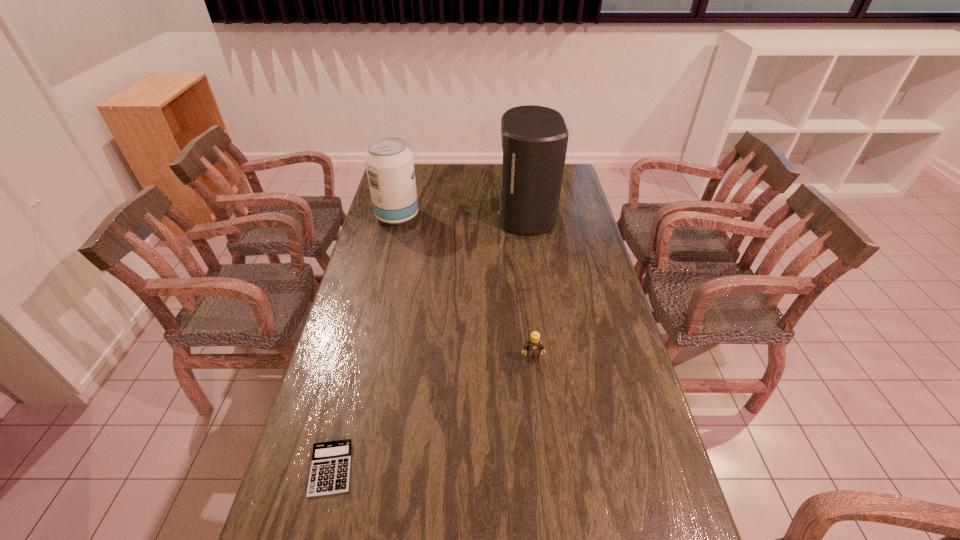
The image size is (960, 540). What are the coordinates of `unoccupied area between the coffee maker and the calculator` in the screenshot? It's located at (428, 341).

Find the location of a particular element. Image resolution: width=960 pixels, height=540 pixels. free space between the alcohol and the tallest object is located at coordinates 462,215.

Find the location of `empty space that is in between the tallest object and the third shortest object`. empty space that is in between the tallest object and the third shortest object is located at coordinates (462, 215).

This screenshot has width=960, height=540. In order to click on empty space between the nearest object and the alcohol in this screenshot , I will do `click(364, 342)`.

You are a GUI agent. You are given a task and a screenshot of the screen. Output one action in this format:
    pyautogui.click(x=<x>, y=<y>)
    Task: Click on the vacant space in between the alcohol and the coffee maker
    The height and width of the screenshot is (540, 960).
    Given the screenshot: What is the action you would take?
    pyautogui.click(x=462, y=215)

I want to click on unoccupied area between the alcohol and the shortest object, so click(x=364, y=342).

The height and width of the screenshot is (540, 960). In order to click on free space that is in between the second nearest object and the alcohol in this screenshot , I will do `click(465, 287)`.

Image resolution: width=960 pixels, height=540 pixels. I want to click on free space between the nearest object and the second tallest object, so click(364, 342).

Identify which object is located as the nearest to the coffee maker. Please provide its 2D coordinates. Your answer should be formatted as a tuple, i.e. [(x, y)], where the tuple contains the x and y coordinates of a point satisfying the conditions above.

[(389, 163)]

Locate an element on the screen. Image resolution: width=960 pixels, height=540 pixels. object that is the third closest one to the nearest object is located at coordinates (534, 139).